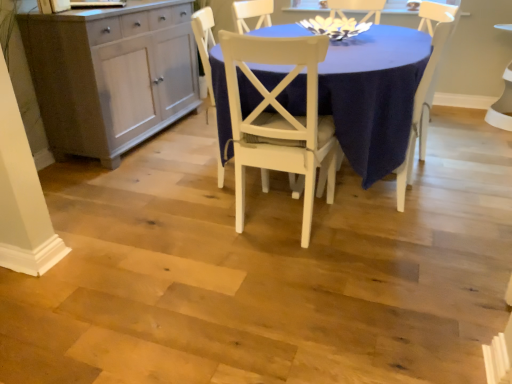
Question: Does white wood chair at center, which is counted as the 3th chair, starting from the left, appear on the right side of white matte chair at center, which is the 2th chair in left-to-right order?

Choices:
 (A) no
 (B) yes

Answer: (B)

Question: Can white matte chair at center, which is the 2th chair in left-to-right order, be found inside white wood chair at center, which ranks as the first chair in right-to-left order?

Choices:
 (A) yes
 (B) no

Answer: (B)

Question: Does white wood chair at center, which ranks as the first chair in right-to-left order, have a lesser height compared to white matte chair at center, which is the 2th chair in left-to-right order?

Choices:
 (A) no
 (B) yes

Answer: (A)

Question: Is white wood chair at center, which ranks as the first chair in right-to-left order, positioned far away from white matte chair at center, which is the 2th chair in left-to-right order?

Choices:
 (A) no
 (B) yes

Answer: (A)

Question: Is white wood chair at center, which is counted as the 3th chair, starting from the left, not inside white matte chair at center, positioned as the second chair in right-to-left order?

Choices:
 (A) yes
 (B) no

Answer: (A)

Question: In terms of width, does white wood chair at center, which ranks as the first chair in left-to-right order, look wider or thinner when compared to matte gray cabinet at left?

Choices:
 (A) thin
 (B) wide

Answer: (A)

Question: Considering the positions of point (206, 29) and point (161, 94), is point (206, 29) closer or farther from the camera than point (161, 94)?

Choices:
 (A) closer
 (B) farther

Answer: (A)

Question: From the image's perspective, is white wood chair at center, which ranks as the first chair in left-to-right order, above or below matte gray cabinet at left?

Choices:
 (A) above
 (B) below

Answer: (B)

Question: Visually, is white wood chair at center, arranged as the third chair when viewed from the right, positioned to the left or to the right of matte gray cabinet at left?

Choices:
 (A) left
 (B) right

Answer: (B)

Question: Is white wood chair at center, which ranks as the first chair in right-to-left order, inside the boundaries of matte gray cabinet at left, or outside?

Choices:
 (A) inside
 (B) outside

Answer: (B)

Question: Is point (441, 31) positioned closer to the camera than point (55, 144)?

Choices:
 (A) farther
 (B) closer

Answer: (B)

Question: Is white wood chair at center, which is counted as the 3th chair, starting from the left, bigger or smaller than matte gray cabinet at left?

Choices:
 (A) small
 (B) big

Answer: (A)

Question: Considering the positions of white wood chair at center, which is counted as the 3th chair, starting from the left, and matte gray cabinet at left in the image, is white wood chair at center, which is counted as the 3th chair, starting from the left, wider or thinner than matte gray cabinet at left?

Choices:
 (A) thin
 (B) wide

Answer: (A)

Question: From their relative heights in the image, would you say matte gray cabinet at left is taller or shorter than white wood chair at center, arranged as the third chair when viewed from the right?

Choices:
 (A) short
 (B) tall

Answer: (A)

Question: Considering their positions, is matte gray cabinet at left located in front of or behind white wood chair at center, arranged as the third chair when viewed from the right?

Choices:
 (A) behind
 (B) front

Answer: (A)